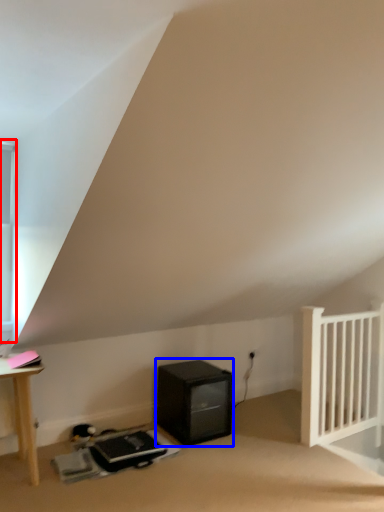
Question: Among these objects, which one is nearest to the camera, window (highlighted by a red box) or appliance (highlighted by a blue box)?

Choices:
 (A) window
 (B) appliance

Answer: (A)